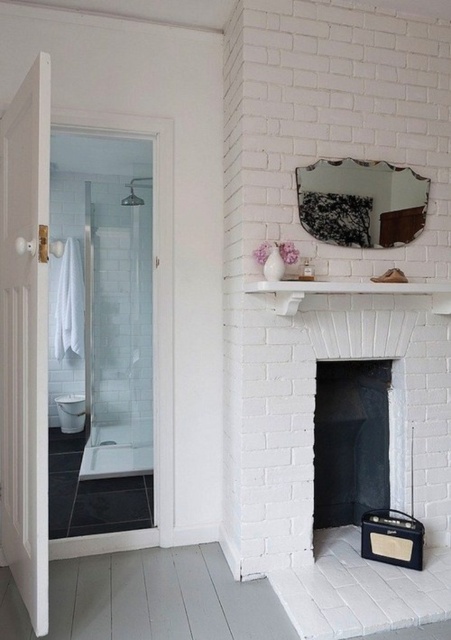
Question: Is white matte shelf at upper center bigger than brushed metal shower at upper left?

Choices:
 (A) no
 (B) yes

Answer: (B)

Question: Estimate the real-world distances between objects in this image. Which object is closer to the white matte shelf at upper center?

Choices:
 (A) brushed metal shower at upper left
 (B) matte black radio at lower right

Answer: (B)

Question: Can you confirm if white matte shelf at upper center is bigger than brushed metal shower at upper left?

Choices:
 (A) no
 (B) yes

Answer: (B)

Question: Which object is closer to the camera taking this photo?

Choices:
 (A) white glossy bathtub at left
 (B) brushed metal shower at upper left

Answer: (A)

Question: Estimate the real-world distances between objects in this image. Which object is farther from the brushed metal shower at upper left?

Choices:
 (A) matte black radio at lower right
 (B) white matte shelf at upper center
 (C) white glossy bathtub at left
 (D) black matte fireplace at center

Answer: (A)

Question: Does white glossy bathtub at left have a lesser width compared to matte black radio at lower right?

Choices:
 (A) yes
 (B) no

Answer: (B)